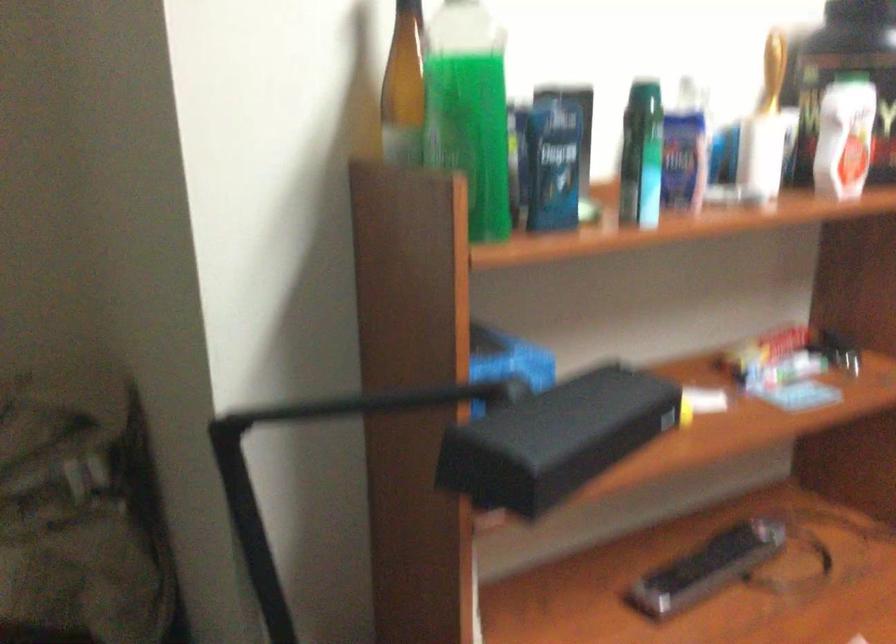
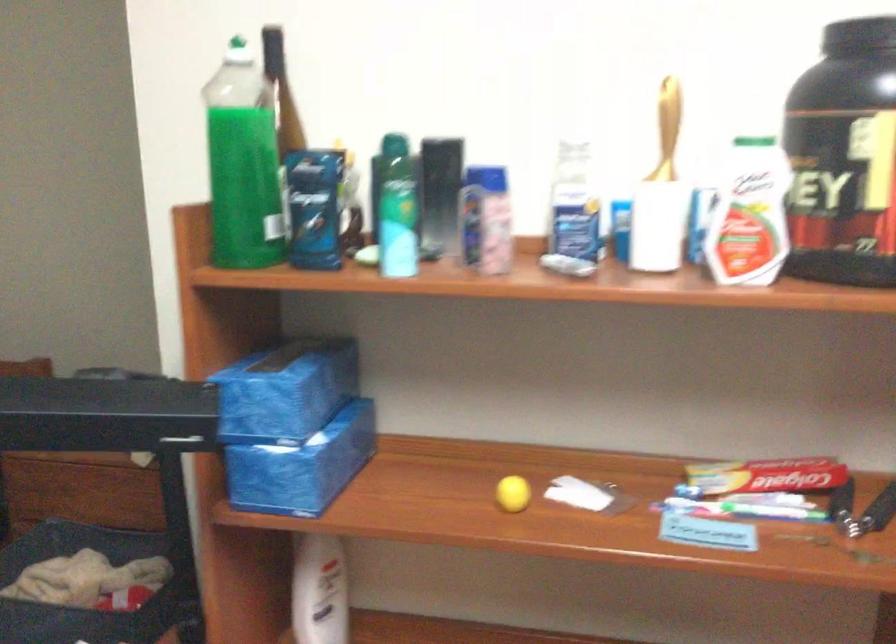
In the second image, find the point that corresponds to the point at 431,109 in the first image.

(243, 163)